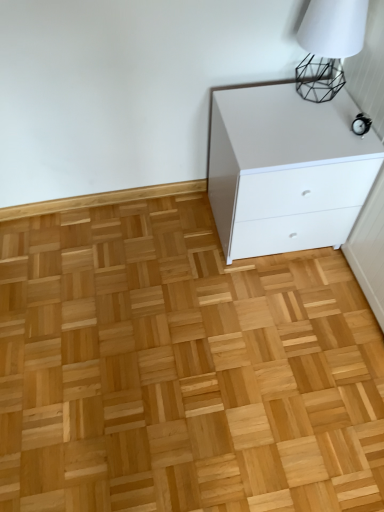
This screenshot has height=512, width=384. I want to click on vacant area on top of white glossy chest of drawers at upper right (from a real-world perspective), so click(301, 120).